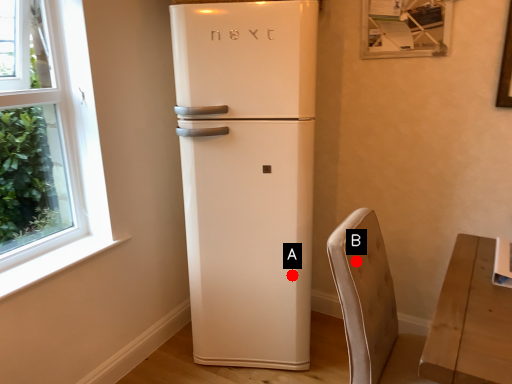
Question: Two points are circled on the image, labeled by A and B beside each circle. Which point is closer to the camera taking this photo?

Choices:
 (A) A is closer
 (B) B is closer

Answer: (B)